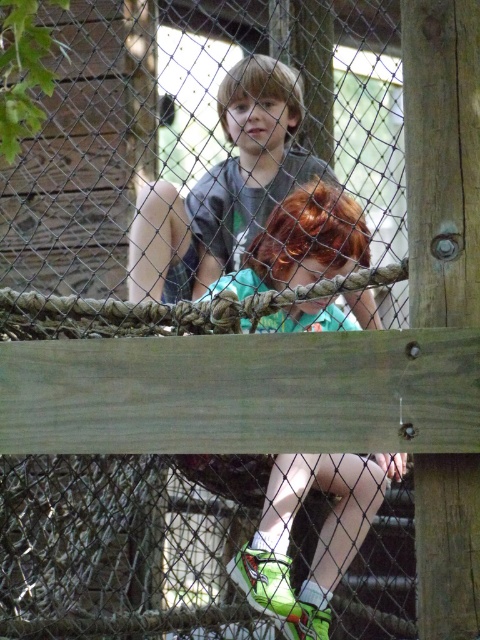
Question: Which object appears closest to the camera in this image?

Choices:
 (A) green fabric shirt at center
 (B) matte gray shirt at center

Answer: (A)

Question: Which point appears closest to the camera in this image?

Choices:
 (A) (298, 164)
 (B) (325, 228)

Answer: (B)

Question: Can you confirm if green fabric shirt at center is thinner than matte gray shirt at center?

Choices:
 (A) no
 (B) yes

Answer: (B)

Question: Can you confirm if green fabric shirt at center is positioned to the right of matte gray shirt at center?

Choices:
 (A) no
 (B) yes

Answer: (B)

Question: Is green fabric shirt at center wider than matte gray shirt at center?

Choices:
 (A) no
 (B) yes

Answer: (A)

Question: Which point appears closest to the camera in this image?

Choices:
 (A) (250, 220)
 (B) (268, 227)

Answer: (B)